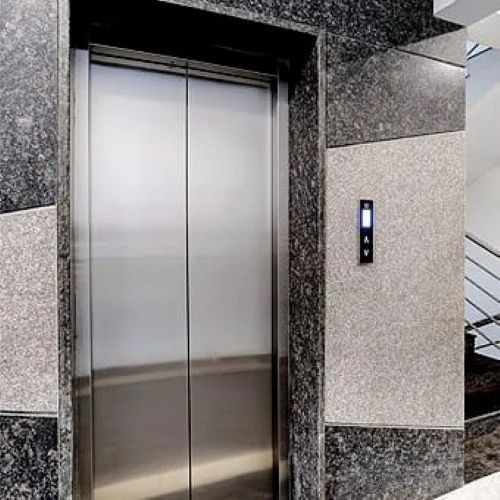
At what (x,y) coordinates should I click in order to perform the action: click on bottom edge of elevator button. Please return your answer as a coordinate pair (x, y). Looking at the image, I should click on (366, 263).